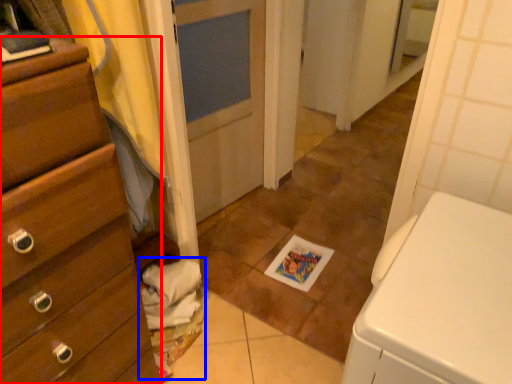
Question: Which object is closer to the camera taking this photo, chest of drawers (highlighted by a red box) or laundry (highlighted by a blue box)?

Choices:
 (A) chest of drawers
 (B) laundry

Answer: (A)